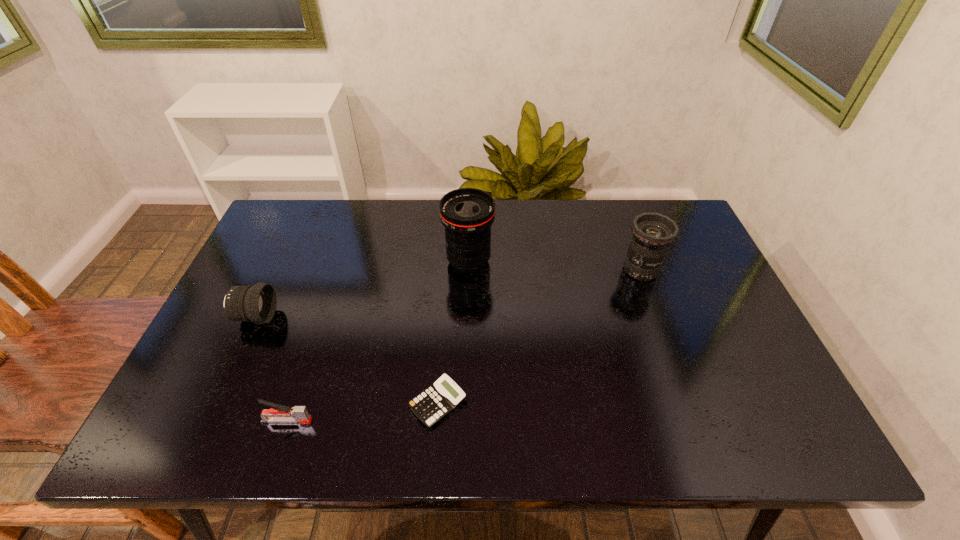
Find the location of `vacant space at the near edge of the desktop`. vacant space at the near edge of the desktop is located at coordinates (712, 413).

Locate an element on the screen. The image size is (960, 540). free region at the right edge is located at coordinates (687, 273).

This screenshot has width=960, height=540. In order to click on free spot at the far left corner of the desktop in this screenshot , I will do `click(311, 222)`.

Locate an element on the screen. vacant space at the near left corner of the desktop is located at coordinates (175, 424).

This screenshot has width=960, height=540. Identify the location of vacant space at the far right corner of the desktop. (684, 221).

At what (x,y) coordinates should I click in order to perform the action: click on free spot between the second tallest object and the leftmost telephoto lens. Please return your answer as a coordinate pair (x, y). The image size is (960, 540). Looking at the image, I should click on (448, 293).

I want to click on vacant point located between the stapler and the leftmost object, so click(x=272, y=369).

The height and width of the screenshot is (540, 960). What are the coordinates of `vacant space in between the calculator and the second shortest telephoto lens` in the screenshot? It's located at (540, 336).

Identify the location of empty location between the calculator and the stapler. The height and width of the screenshot is (540, 960). (363, 412).

The width and height of the screenshot is (960, 540). Find the location of `empty location between the nearest telephoto lens and the rightmost object`. empty location between the nearest telephoto lens and the rightmost object is located at coordinates (448, 293).